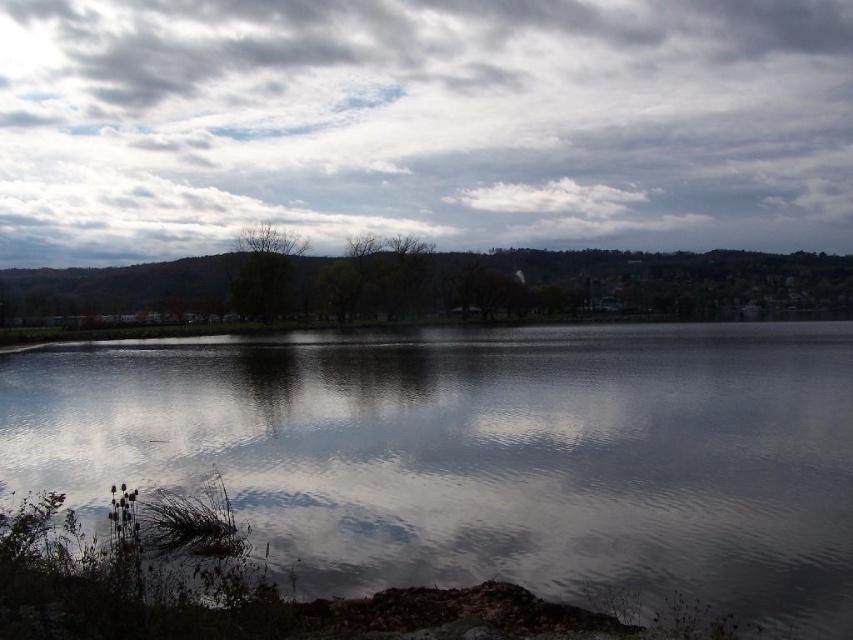
Question: Among these points, which one is farthest from the camera?

Choices:
 (A) (780, 372)
 (B) (293, 65)

Answer: (B)

Question: Can you confirm if glossy reflective water at center is bigger than green matte tree at center?

Choices:
 (A) no
 (B) yes

Answer: (B)

Question: Which object is the farthest from the cloudy sky at upper center?

Choices:
 (A) glossy reflective water at center
 (B) green matte tree at center

Answer: (A)

Question: Which object is the farthest from the cloudy sky at upper center?

Choices:
 (A) green matte tree at center
 (B) glossy reflective water at center

Answer: (B)

Question: Is glossy reflective water at center bigger than green matte tree at center?

Choices:
 (A) yes
 (B) no

Answer: (A)

Question: Can you confirm if cloudy sky at upper center is thinner than glossy reflective water at center?

Choices:
 (A) no
 (B) yes

Answer: (A)